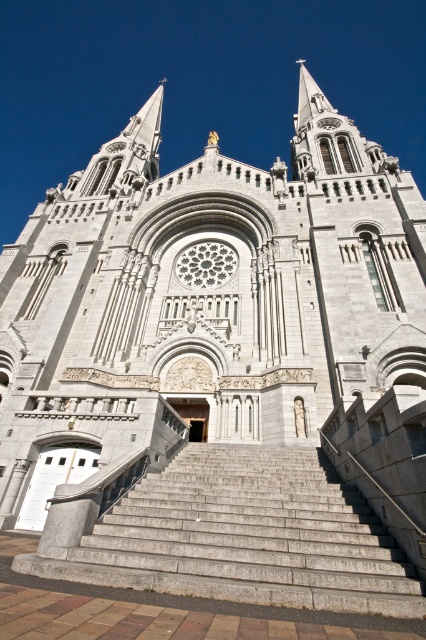
You are standing at the base of the gray concrete stairs at center leading up to the gray stone church at center. If you want to walk towards the church, which direction should you move relative to the stairs?

Since the gray stone church at center is to the right of the gray concrete stairs at center, you should move to your right to walk towards the church.

You are standing in a plaza in front of the gray stone church at center. The church is a popular tourist spot, and you want to take a photo of it from a distance where it still looks grand but not too small. Considering the church is 107.14 feet away from you, is this a suitable distance for taking such a photo?

The gray stone church at center is 107.14 feet away from the viewer. This distance is suitable for taking a photo where the church appears grand yet not overly small, as it provides a balanced perspective to capture its majestic architecture without losing detail.